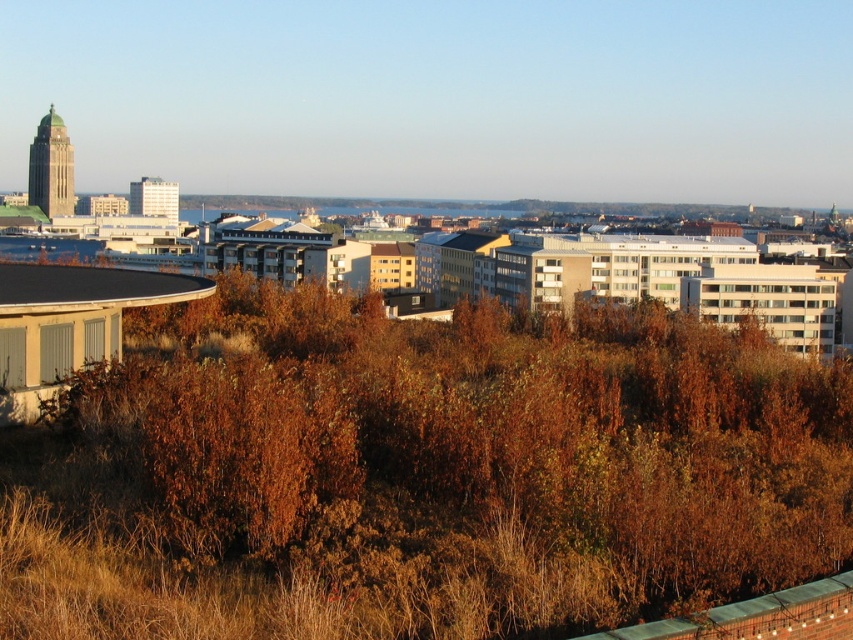
Can you confirm if brown leafy shrub at left is smaller than blue glass water at lower left?

Yes, brown leafy shrub at left is smaller than blue glass water at lower left.

Is brown leafy shrub at left positioned at the back of blue glass water at lower left?

No, brown leafy shrub at left is closer to the viewer.

Is point (465, 604) closer to viewer compared to point (22, 237)?

That is True.

This screenshot has height=640, width=853. Identify the location of brown leafy shrub at left. (467, 458).